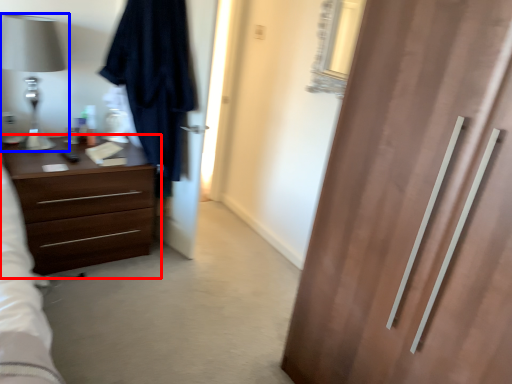
Question: Which object is closer to the camera taking this photo, chest of drawers (highlighted by a red box) or table lamp (highlighted by a blue box)?

Choices:
 (A) chest of drawers
 (B) table lamp

Answer: (B)